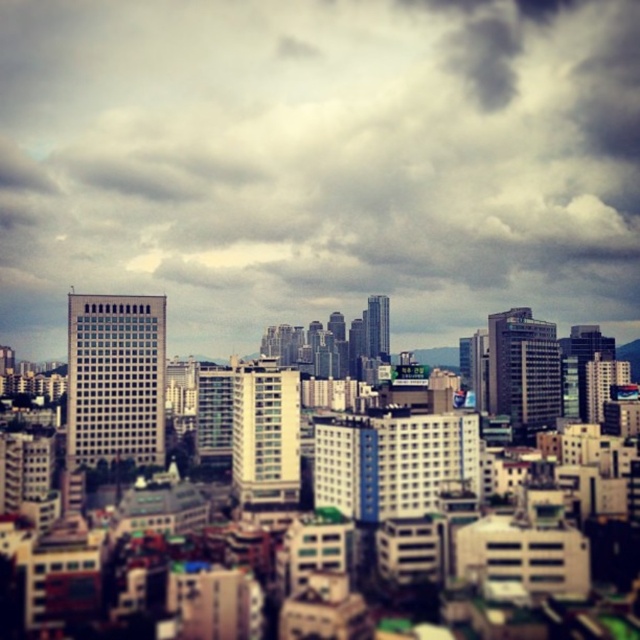
Question: Can you confirm if cloudy sky at upper center is positioned below white glass building at center?

Choices:
 (A) no
 (B) yes

Answer: (A)

Question: Is cloudy sky at upper center thinner than white glass building at center?

Choices:
 (A) no
 (B) yes

Answer: (A)

Question: Which point is closer to the camera?

Choices:
 (A) cloudy sky at upper center
 (B) white glass building at center

Answer: (B)

Question: Where is cloudy sky at upper center located in relation to white glass building at center in the image?

Choices:
 (A) left
 (B) right

Answer: (A)